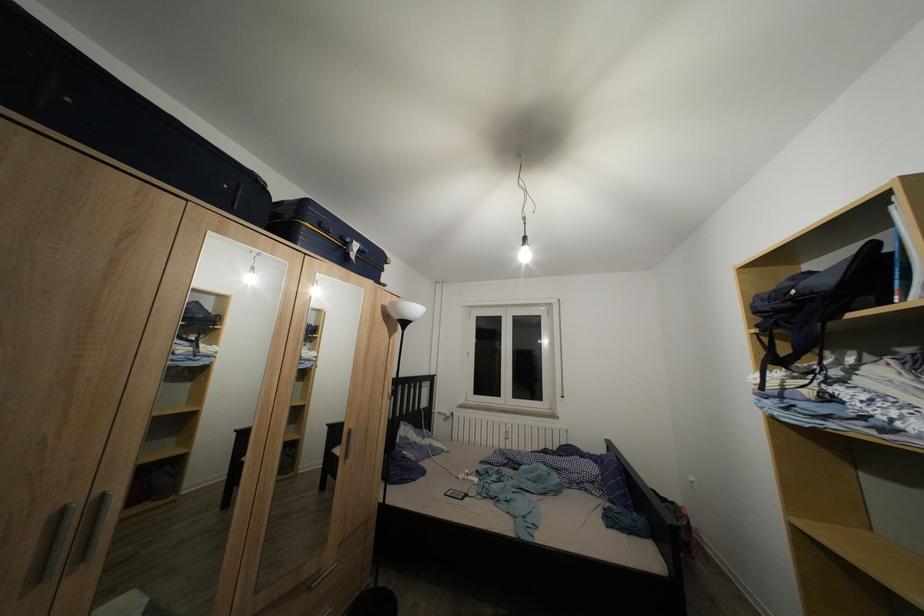
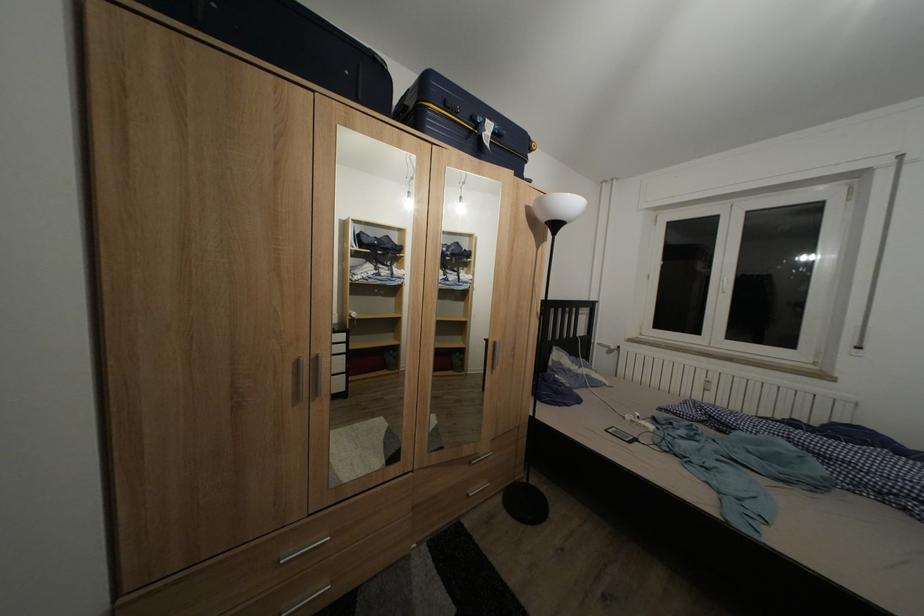
Question: The first image is from the beginning of the video and the second image is from the end. How did the camera likely rotate when shooting the video?

Choices:
 (A) Left
 (B) Right
 (C) Up
 (D) Down

Answer: (A)